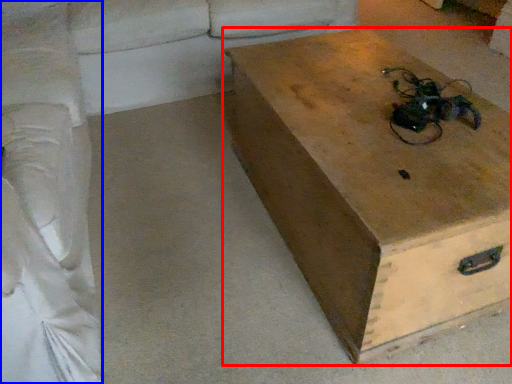
Question: Which object appears farthest to the camera in this image, box (highlighted by a red box) or couch (highlighted by a blue box)?

Choices:
 (A) box
 (B) couch

Answer: (A)